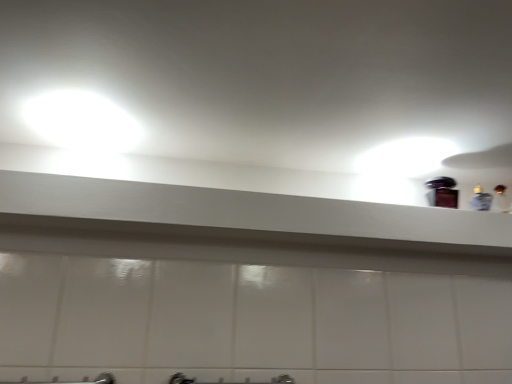
The height and width of the screenshot is (384, 512). Describe the element at coordinates (244, 216) in the screenshot. I see `white matte shelf at upper center` at that location.

This screenshot has height=384, width=512. What are the coordinates of `white matte shelf at upper center` in the screenshot? It's located at (244, 216).

I want to click on white matte shelf at upper center, so click(244, 216).